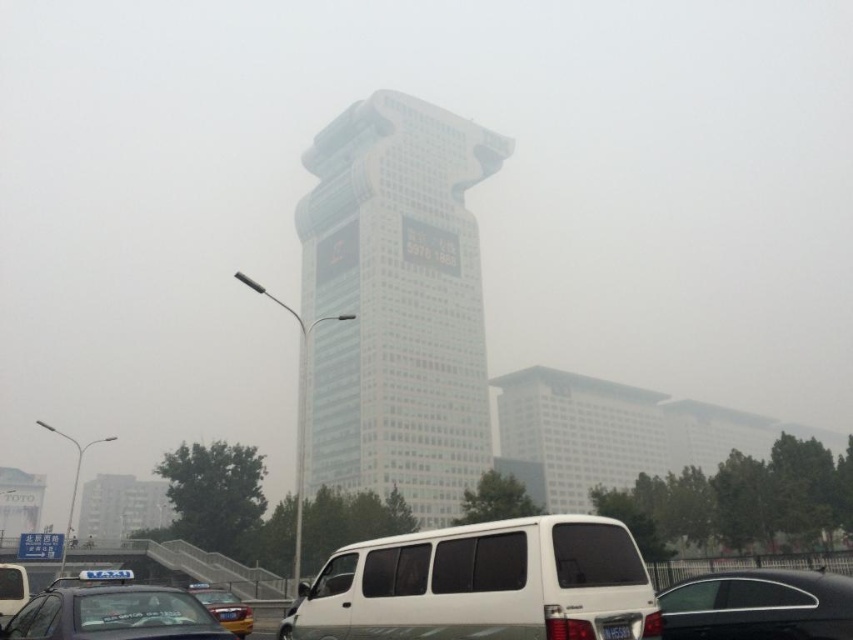
Question: Can you confirm if white glass building at center is positioned below white matte van at center?

Choices:
 (A) yes
 (B) no

Answer: (B)

Question: Which object is the farthest from the black plastic taxi cab at lower left?

Choices:
 (A) black plastic license plate at center
 (B) white glass building at center
 (C) matte black taxi at lower left

Answer: (B)

Question: Which of these objects is positioned closest to the matte black taxi at lower left?

Choices:
 (A) white glass building at center
 (B) black glossy car at lower right

Answer: (B)

Question: Which object is closer to the camera taking this photo?

Choices:
 (A) white glass building at center
 (B) white matte van at center
 (C) yellow metallic car at lower center
 (D) black plastic license plate at center

Answer: (B)

Question: Is black glossy car at lower right further to the viewer compared to yellow metallic car at lower center?

Choices:
 (A) yes
 (B) no

Answer: (B)

Question: Does white matte van at center have a greater width compared to matte black taxi at lower left?

Choices:
 (A) no
 (B) yes

Answer: (B)